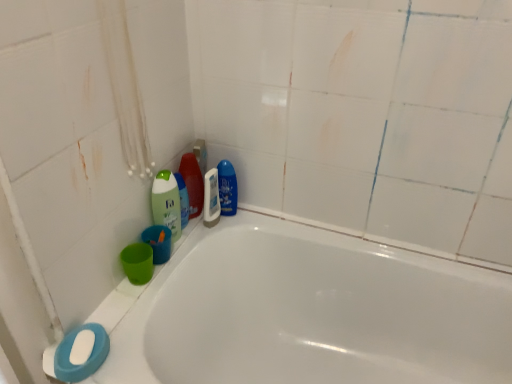
Find the location of a particular element. The height and width of the screenshot is (384, 512). spots to the right of white matte soap at lower left is located at coordinates (124, 354).